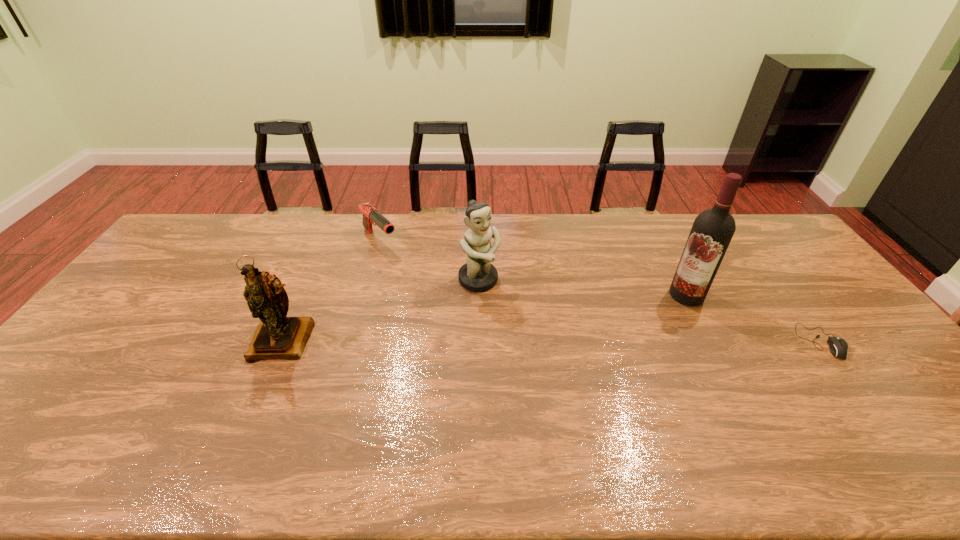
Where is `the nearer figurine`? The image size is (960, 540). the nearer figurine is located at coordinates (277, 336).

Where is `the left figurine`? The image size is (960, 540). the left figurine is located at coordinates (277, 336).

Where is `the shortest object`? Image resolution: width=960 pixels, height=540 pixels. the shortest object is located at coordinates (838, 347).

The image size is (960, 540). Identify the location of the rightmost object. (838, 347).

Find the location of a particular element. The image size is (960, 540). the third object from left to right is located at coordinates (478, 275).

Locate an element on the screen. This screenshot has height=540, width=960. the farther figurine is located at coordinates (478, 275).

The image size is (960, 540). What are the coordinates of `the fourth object from left to right` in the screenshot? It's located at (712, 231).

You are a GUI agent. You are given a task and a screenshot of the screen. Output one action in this format:
    pyautogui.click(x=<x>, y=<y>)
    Task: Click on the tallest object
    
    Given the screenshot: What is the action you would take?
    pyautogui.click(x=712, y=231)

Locate an element on the screen. gun is located at coordinates (371, 215).

Where is `the second object from left to right`? the second object from left to right is located at coordinates (371, 215).